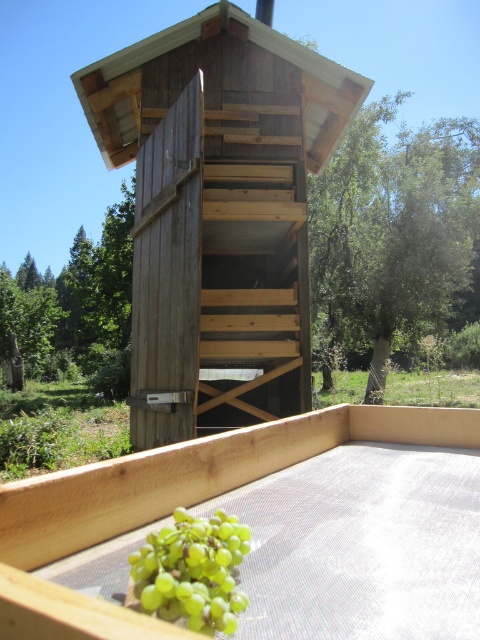
Is wooden hut at center below green matte grapes at lower center?

No, wooden hut at center is not below green matte grapes at lower center.

Where is `wooden hut at center`? This screenshot has width=480, height=640. wooden hut at center is located at coordinates (217, 212).